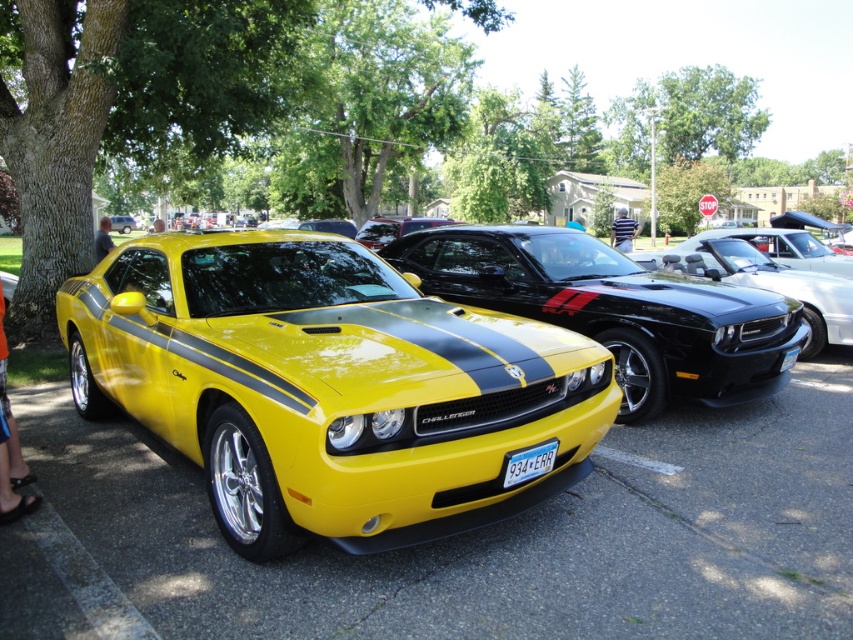
Is yellow glossy dodge challenger at center wider than glossy black car at center?

Correct, the width of yellow glossy dodge challenger at center exceeds that of glossy black car at center.

Between yellow glossy dodge challenger at center and glossy black car at center, which one has less height?

With less height is glossy black car at center.

Locate an element on the screen. This screenshot has height=640, width=853. yellow glossy dodge challenger at center is located at coordinates (616, 310).

Can you confirm if yellow glossy dodge challenger at center is smaller than white plastic license plate at center?

Incorrect, yellow glossy dodge challenger at center is not smaller in size than white plastic license plate at center.

Is yellow glossy dodge challenger at center bigger than white plastic license plate at center?

Correct, yellow glossy dodge challenger at center is larger in size than white plastic license plate at center.

Between point (639, 273) and point (543, 472), which one is positioned behind?

Positioned behind is point (639, 273).

Identify the location of yellow glossy dodge challenger at center. [616, 310].

Does shiny yellow muscle car at center appear on the left side of white plastic license plate at center?

Yes, shiny yellow muscle car at center is to the left of white plastic license plate at center.

Does point (318, 449) lie behind point (517, 472)?

No, it is in front of (517, 472).

What do you see at coordinates (328, 387) in the screenshot? I see `shiny yellow muscle car at center` at bounding box center [328, 387].

Image resolution: width=853 pixels, height=640 pixels. Identify the location of shiny yellow muscle car at center. (328, 387).